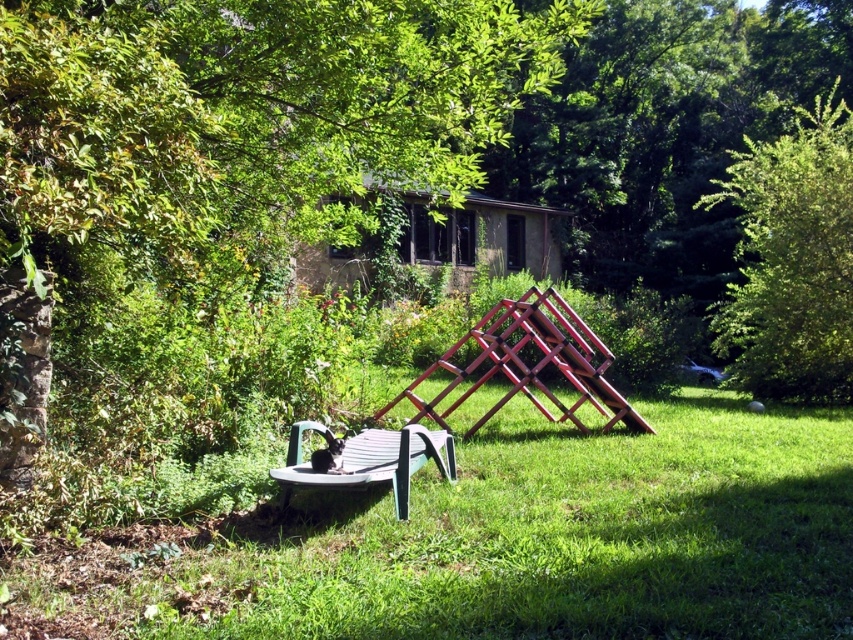
Question: Can you confirm if green leafy tree at center is positioned above wooden chair at center?

Choices:
 (A) yes
 (B) no

Answer: (A)

Question: Which point is closer to the camera?

Choices:
 (A) (335, 154)
 (B) (838, 168)
 (C) (550, 396)

Answer: (A)

Question: Based on their relative distances, which object is nearer to the green leafy tree at center?

Choices:
 (A) wooden chair at center
 (B) green leafy tree at upper right

Answer: (A)

Question: Can you confirm if green leafy tree at center is positioned to the left of wooden chair at center?

Choices:
 (A) yes
 (B) no

Answer: (A)

Question: Is green leafy tree at upper right positioned before wooden chair at center?

Choices:
 (A) no
 (B) yes

Answer: (A)

Question: Which of the following is the farthest from the observer?

Choices:
 (A) (492, 356)
 (B) (502, 90)
 (C) (770, 177)

Answer: (C)